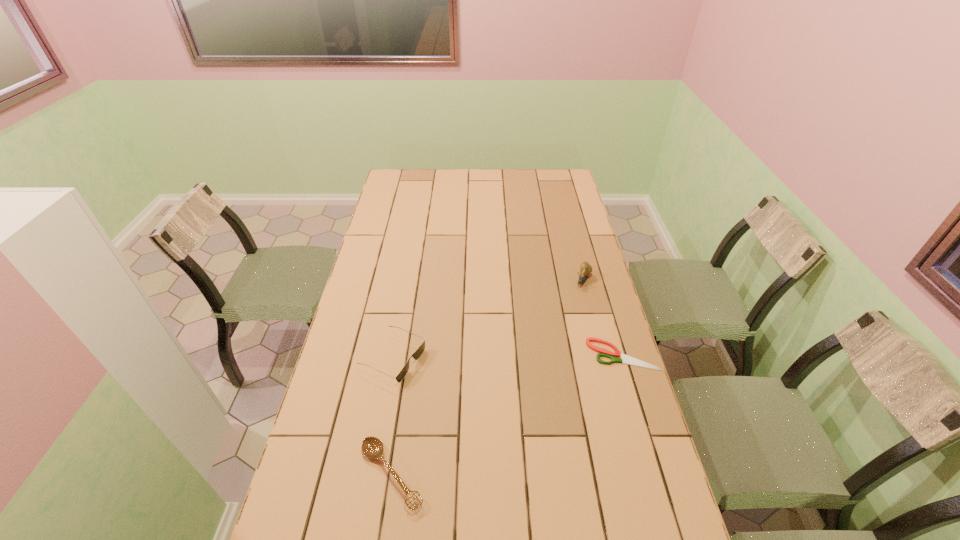
Identify the location of vacant space on the desktop that is between the ladle and the shortest object and is positioned on the front-facing side of the third shortest object. Image resolution: width=960 pixels, height=540 pixels. coord(514,411).

This screenshot has width=960, height=540. I want to click on free space on the desktop that is between the nearest object and the shortest object and is positioned on the front-facing side of the farthest object, so click(x=527, y=404).